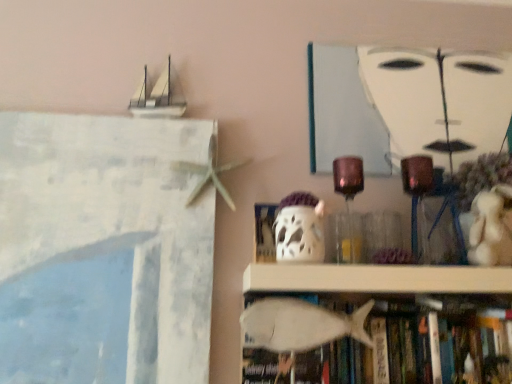
Question: Is white matte fish at lower center smaller than white plush bear at right?

Choices:
 (A) yes
 (B) no

Answer: (B)

Question: Considering the relative sizes of white matte fish at lower center and white plush bear at right in the image provided, is white matte fish at lower center bigger than white plush bear at right?

Choices:
 (A) no
 (B) yes

Answer: (B)

Question: From the image's perspective, does white matte fish at lower center appear higher than white plush bear at right?

Choices:
 (A) no
 (B) yes

Answer: (A)

Question: Does white matte fish at lower center appear on the right side of white plush bear at right?

Choices:
 (A) no
 (B) yes

Answer: (A)

Question: Is white matte fish at lower center facing away from white plush bear at right?

Choices:
 (A) yes
 (B) no

Answer: (B)

Question: Is white matte fish at lower center wider than white plush bear at right?

Choices:
 (A) no
 (B) yes

Answer: (B)

Question: Is white matte painting at upper center further to camera compared to white matte ghost at center?

Choices:
 (A) no
 (B) yes

Answer: (B)

Question: Is white matte painting at upper center thinner than white matte ghost at center?

Choices:
 (A) no
 (B) yes

Answer: (B)

Question: Is white matte painting at upper center closer to camera compared to white matte ghost at center?

Choices:
 (A) yes
 (B) no

Answer: (B)

Question: Considering the relative sizes of white matte painting at upper center and white matte ghost at center in the image provided, is white matte painting at upper center bigger than white matte ghost at center?

Choices:
 (A) no
 (B) yes

Answer: (B)

Question: Could you tell me if white matte painting at upper center is facing white matte ghost at center?

Choices:
 (A) yes
 (B) no

Answer: (B)

Question: From a real-world perspective, is white matte painting at upper center beneath white matte ghost at center?

Choices:
 (A) no
 (B) yes

Answer: (A)

Question: Is white matte fish at lower center surrounding white matte painting at upper center?

Choices:
 (A) yes
 (B) no

Answer: (B)